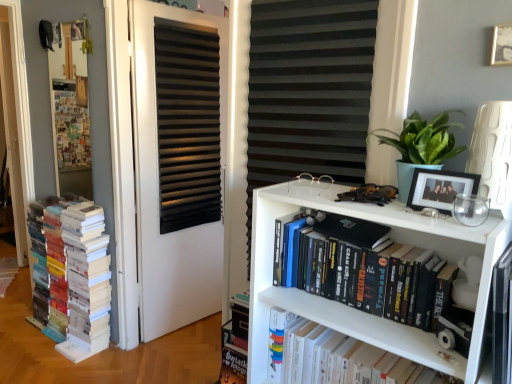
What do you see at coordinates (308, 92) in the screenshot?
I see `black matte shutter at center` at bounding box center [308, 92].

What do you see at coordinates (501, 45) in the screenshot? I see `gold metallic picture frame at upper right, positioned as the 1th picture frame in top-to-bottom order` at bounding box center [501, 45].

The width and height of the screenshot is (512, 384). I want to click on black matte bookshelf at center, which is the 2th book in right-to-left order, so click(365, 269).

Looking at their sizes, would you say gold metallic picture frame at upper right, the 2th picture frame ordered from the bottom, is wider or thinner than black matte picture frame at upper right, the 1th picture frame in the left-to-right sequence?

gold metallic picture frame at upper right, the 2th picture frame ordered from the bottom, is thinner than black matte picture frame at upper right, the 1th picture frame in the left-to-right sequence.

Relative to black matte picture frame at upper right, the 2th picture frame in the top-to-bottom sequence, is gold metallic picture frame at upper right, the 1th picture frame positioned from the right, in front or behind?

In the image, gold metallic picture frame at upper right, the 1th picture frame positioned from the right, appears behind black matte picture frame at upper right, the 2th picture frame in the top-to-bottom sequence.

Is gold metallic picture frame at upper right, positioned as the 1th picture frame in top-to-bottom order, oriented towards black matte picture frame at upper right, the 2th picture frame in the top-to-bottom sequence?

No, gold metallic picture frame at upper right, positioned as the 1th picture frame in top-to-bottom order, is not aimed at black matte picture frame at upper right, the 2th picture frame in the top-to-bottom sequence.

Which is closer to the camera, (x=508, y=30) or (x=73, y=299)?

Point (x=508, y=30) appears to be closer to the viewer than point (x=73, y=299).

From the image's perspective, is gold metallic picture frame at upper right, the 1th picture frame positioned from the right, over multicolored paper books at left, arranged as the 3th book when viewed from the right?

Correct, gold metallic picture frame at upper right, the 1th picture frame positioned from the right, appears higher than multicolored paper books at left, arranged as the 3th book when viewed from the right, in the image.

Based on the photo, between gold metallic picture frame at upper right, the 1th picture frame positioned from the right, and multicolored paper books at left, positioned as the third book in front-to-back order, which one appears on the right side from the viewer's perspective?

From the viewer's perspective, gold metallic picture frame at upper right, the 1th picture frame positioned from the right, appears more on the right side.

Can you confirm if gold metallic picture frame at upper right, the 1th picture frame positioned from the right, is thinner than multicolored paper books at left, positioned as the third book in front-to-back order?

Yes.

From the picture: Is black matte door at center wider or thinner than gold metallic picture frame at upper right, the 1th picture frame positioned from the right?

Clearly, black matte door at center has more width compared to gold metallic picture frame at upper right, the 1th picture frame positioned from the right.

Which is more to the right, black matte door at center or gold metallic picture frame at upper right, positioned as the 1th picture frame in top-to-bottom order?

From the viewer's perspective, gold metallic picture frame at upper right, positioned as the 1th picture frame in top-to-bottom order, appears more on the right side.

Choose the correct answer: Is black matte door at center inside gold metallic picture frame at upper right, positioned as the 1th picture frame in top-to-bottom order, or outside it?

black matte door at center exists outside the volume of gold metallic picture frame at upper right, positioned as the 1th picture frame in top-to-bottom order.

Consider the image. From a real-world perspective, is black matte door at center on gold metallic picture frame at upper right, the 2th picture frame when ordered from left to right?

Actually, black matte door at center is physically below gold metallic picture frame at upper right, the 2th picture frame when ordered from left to right, in the real world.

Is black matte picture frame at upper right, which is the 1th picture frame from bottom to top, closer to camera compared to black matte shutter at center?

Yes, black matte picture frame at upper right, which is the 1th picture frame from bottom to top, is in front of black matte shutter at center.

From the picture: From a real-world perspective, who is located higher, black matte picture frame at upper right, the 2th picture frame in the top-to-bottom sequence, or black matte shutter at center?

In real-world perspective, black matte picture frame at upper right, the 2th picture frame in the top-to-bottom sequence, is above.

From the picture: Does black matte picture frame at upper right, the second picture frame from the right, touch black matte shutter at center?

black matte picture frame at upper right, the second picture frame from the right, and black matte shutter at center are not in contact.

From the image's perspective, is black matte picture frame at upper right, the second picture frame from the right, located above or below black matte shutter at center?

From the image's perspective, black matte picture frame at upper right, the second picture frame from the right, appears above black matte shutter at center.

Is gold metallic picture frame at upper right, positioned as the 1th picture frame in top-to-bottom order, to the left or to the right of green matte plant at upper right in the image?

gold metallic picture frame at upper right, positioned as the 1th picture frame in top-to-bottom order, is positioned on green matte plant at upper right's right side.

Does gold metallic picture frame at upper right, the 2th picture frame when ordered from left to right, have a larger size compared to green matte plant at upper right?

No, gold metallic picture frame at upper right, the 2th picture frame when ordered from left to right, is not bigger than green matte plant at upper right.

Is gold metallic picture frame at upper right, the 1th picture frame positioned from the right, turned away from green matte plant at upper right?

No, green matte plant at upper right is not at the back of gold metallic picture frame at upper right, the 1th picture frame positioned from the right.

Considering their positions, is gold metallic picture frame at upper right, the 2th picture frame ordered from the bottom, located in front of or behind green matte plant at upper right?

gold metallic picture frame at upper right, the 2th picture frame ordered from the bottom, is positioned farther from the viewer than green matte plant at upper right.

From the image's perspective, does green matte plant at upper right appear lower than black matte door at center?

Incorrect, from the image's perspective, green matte plant at upper right is higher than black matte door at center.

Could you tell me if green matte plant at upper right is facing black matte door at center?

No.

Is point (408, 194) closer to camera compared to point (152, 228)?

Yes, point (408, 194) is closer to viewer.

Between green matte plant at upper right and black matte door at center, which one has larger size?

black matte door at center is bigger.

Can you tell me how much white matte bookshelf at center, arranged as the 3th book when viewed from the left, and wooden bulletin board at left differ in facing direction?

0.857 degrees.

From the image's perspective, which one is positioned higher, white matte bookshelf at center, the 1th book when ordered from right to left, or wooden bulletin board at left?

wooden bulletin board at left.

Which is further, (328,335) or (63,165)?

The point (63,165) is behind.

Which of these two, white matte bookshelf at center, the third book positioned from the back, or wooden bulletin board at left, is wider?

With larger width is white matte bookshelf at center, the third book positioned from the back.

This screenshot has height=384, width=512. In the image, there is a gold metallic picture frame at upper right, the 1th picture frame positioned from the right. In order to click on picture frame below it (from a real-world perspective) in this screenshot , I will do `click(440, 189)`.

Where is `the 3rd book behind the gold metallic picture frame at upper right, the 1th picture frame positioned from the right`? The image size is (512, 384). the 3rd book behind the gold metallic picture frame at upper right, the 1th picture frame positioned from the right is located at coordinates (78, 277).

From the image, which object appears to be nearer to black matte shutter at center, black matte picture frame at upper right, the second picture frame from the right, or multicolored paper books at left, positioned as the third book in front-to-back order?

black matte picture frame at upper right, the second picture frame from the right, is positioned closer to the anchor black matte shutter at center.

Considering their positions, is multicolored paper books at left, which is the first book in left-to-right order, positioned further to black matte picture frame at upper right, the 2th picture frame in the top-to-bottom sequence, than green matte plant at upper right?

multicolored paper books at left, which is the first book in left-to-right order.

When comparing their distances from multicolored paper books at left, positioned as the third book in front-to-back order, does white matte bookshelf at center, which ranks as the first book in front-to-back order, or green matte plant at upper right seem further?

green matte plant at upper right is further to multicolored paper books at left, positioned as the third book in front-to-back order.

Which object lies further to the anchor point black matte door at center, green matte plant at upper right or gold metallic picture frame at upper right, positioned as the 1th picture frame in top-to-bottom order?

gold metallic picture frame at upper right, positioned as the 1th picture frame in top-to-bottom order.

From the image, which object appears to be nearer to multicolored paper books at left, arranged as the 3th book when viewed from the right, white matte bookshelf at center, the 1th book when ordered from right to left, or black matte shutter at center?

The object closer to multicolored paper books at left, arranged as the 3th book when viewed from the right, is black matte shutter at center.

Which object lies further to the anchor point black matte picture frame at upper right, the second picture frame from the right, gold metallic picture frame at upper right, positioned as the 1th picture frame in top-to-bottom order, or multicolored paper books at left, the 1th book in the back-to-front sequence?

multicolored paper books at left, the 1th book in the back-to-front sequence, lies further to black matte picture frame at upper right, the second picture frame from the right, than the other object.

When comparing their distances from green matte plant at upper right, does black matte shutter at center or wooden bulletin board at left seem further?

Based on the image, wooden bulletin board at left appears to be further to green matte plant at upper right.

Estimate the real-world distances between objects in this image. Which object is closer to multicolored paper books at left, positioned as the third book in front-to-back order, black matte shutter at center or gold metallic picture frame at upper right, the 2th picture frame ordered from the bottom?

Among the two, black matte shutter at center is located nearer to multicolored paper books at left, positioned as the third book in front-to-back order.

Identify the location of bulletin board situated between multicolored paper books at left, the 1th book in the back-to-front sequence, and gold metallic picture frame at upper right, the 2th picture frame ordered from the bottom, from left to right. (70, 109).

I want to click on shutter between green matte plant at upper right and black matte bookshelf at center, the second book when ordered from front to back, from top to bottom, so click(308, 92).

Where is `picture frame between green matte plant at upper right and black matte bookshelf at center, which is the 2th book in right-to-left order, from top to bottom`? This screenshot has height=384, width=512. picture frame between green matte plant at upper right and black matte bookshelf at center, which is the 2th book in right-to-left order, from top to bottom is located at coordinates (440, 189).

I want to click on houseplant between gold metallic picture frame at upper right, the 1th picture frame positioned from the right, and black matte bookshelf at center, which is the 2th book in right-to-left order, in the up-down direction, so [420, 146].